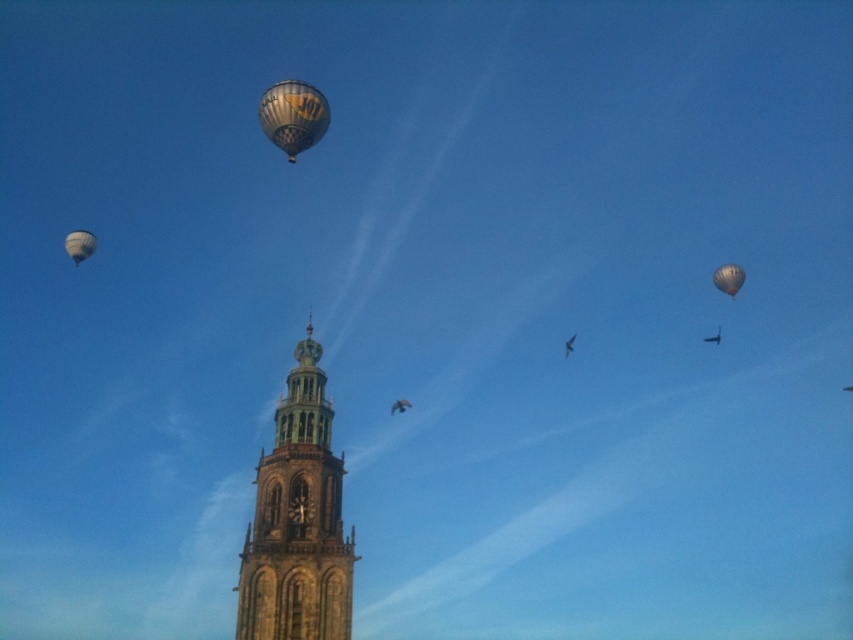
You are an observer looking at the sky scene. You see the matte white balloon at upper left and the matte black balloon at upper right. Which balloon is positioned higher in the sky?

The matte white balloon at upper left is positioned higher in the sky than the matte black balloon at upper right.

You are standing at the base of the clock tower and want to look at two points in the sky, point A at coordinates point A is point (260, 612) and point B is point (265, 108). Which point will appear closer to you when looking from the clock tower?

Point A at coordinates point A is point (260, 612) will appear closer to you because it is in front of point B at coordinates point B is point (265, 108).

You are standing at the center of the image and want to locate the stone clock tower at center. What are the coordinates where you should look?

The stone clock tower at center is located at coordinates point (297, 522).